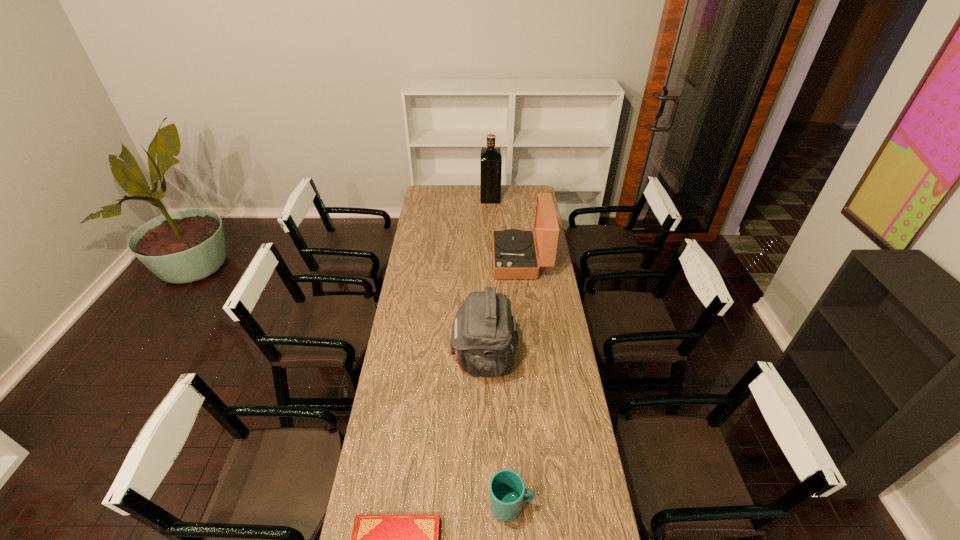
Locate an element on the screen. The width and height of the screenshot is (960, 540). free space located on the open flap of the shoulder bag is located at coordinates (392, 357).

Where is `vacant space located 0.250m on the face of the phonograph record`? vacant space located 0.250m on the face of the phonograph record is located at coordinates (444, 260).

Locate an element on the screen. vacant position located on the face of the phonograph record is located at coordinates (437, 260).

In order to click on free space located on the face of the phonograph record in this screenshot , I will do `click(433, 260)`.

Locate an element on the screen. The image size is (960, 540). object at the far edge is located at coordinates (490, 157).

Find the location of a particular element. The height and width of the screenshot is (540, 960). object that is at the right edge is located at coordinates (514, 253).

In the image, there is a desktop. Identify the location of vacant space at the far edge. (465, 202).

The image size is (960, 540). I want to click on free region at the left edge of the desktop, so click(x=428, y=296).

Locate an element on the screen. The height and width of the screenshot is (540, 960). vacant space at the right edge of the desktop is located at coordinates (599, 510).

The width and height of the screenshot is (960, 540). I want to click on empty space that is in between the cup and the shoulder bag, so click(x=497, y=431).